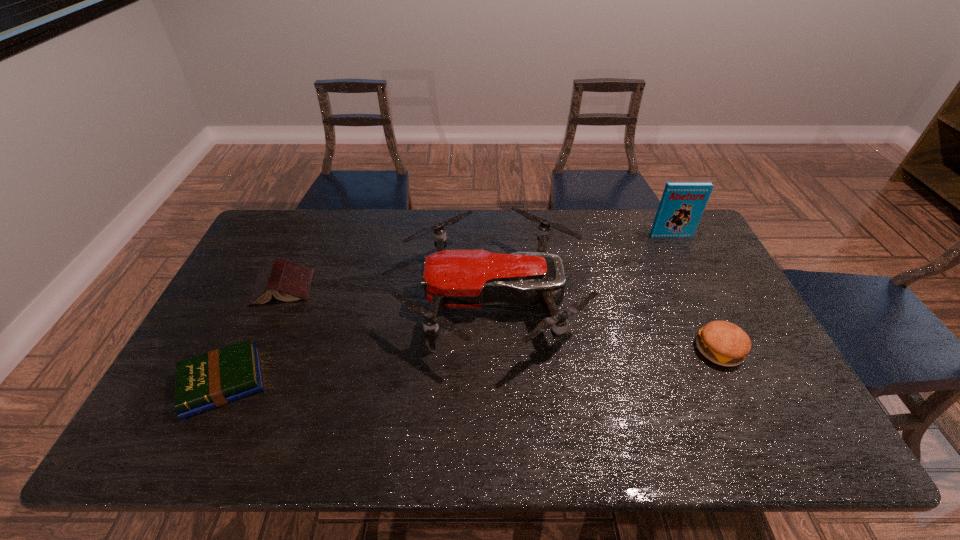
Identify the location of the tallest object. The image size is (960, 540). (682, 204).

Identify the location of the farthest object. (682, 204).

The width and height of the screenshot is (960, 540). Find the location of `drone`. drone is located at coordinates (452, 278).

Locate an element on the screen. Image resolution: width=960 pixels, height=540 pixels. the third object from right to left is located at coordinates (452, 278).

Find the location of a particular element. The height and width of the screenshot is (540, 960). the third shortest object is located at coordinates (724, 343).

At what (x,y) coordinates should I click in order to perform the action: click on the second tallest book. Please return your answer as a coordinate pair (x, y). The width and height of the screenshot is (960, 540). Looking at the image, I should click on (x=287, y=281).

Identify the location of the second shortest object. (287, 281).

Where is `the nearest book`? The image size is (960, 540). the nearest book is located at coordinates (213, 379).

Where is `the shortest book`? the shortest book is located at coordinates (213, 379).

Locate an element on the screen. The width and height of the screenshot is (960, 540). vacant space situated on the front cover of the tallest object is located at coordinates (698, 289).